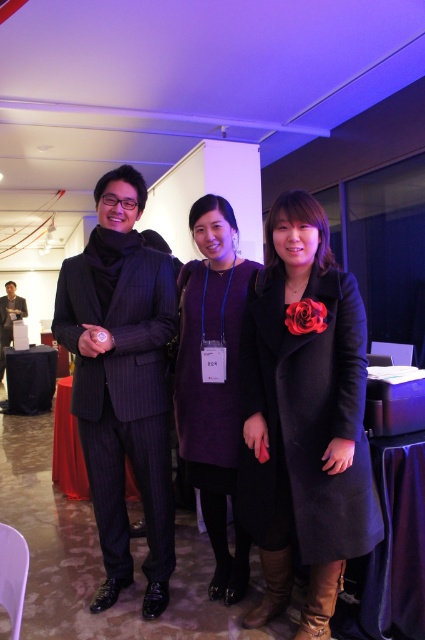
You are a photographer at the event and need to adjust the lighting to focus on the black wool coat at center. Based on its position, which coordinates should you aim the spotlight at?

The black wool coat at center is located at coordinates point (306,419), so you should aim the spotlight at those coordinates to focus on it.

You are a photographer at this event and need to adjust the camera height to capture both the black wool coat at center and the purple wool dress at center in the same frame. Which clothing item should you focus on to ensure both are visible?

The black wool coat at center is not as tall as the purple wool dress at center. To ensure both are visible in the frame, focus on the purple wool dress at center since it is taller and adjust the camera height accordingly.

You are a photographer setting up a backdrop for a group photo. You need to ensure that both the black wool coat at center and the purple wool dress at center are fully visible in the frame. Based on their widths, which clothing item requires more horizontal space to accommodate its width?

The black wool coat at center might be wider than the purple wool dress at center, so it requires more horizontal space to accommodate its width.